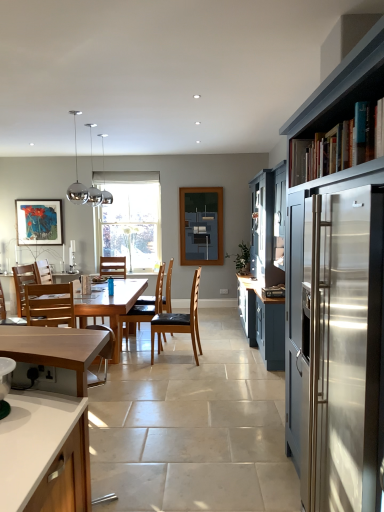
Question: Considering the positions of point (109, 258) and point (372, 285), is point (109, 258) closer or farther from the camera than point (372, 285)?

Choices:
 (A) closer
 (B) farther

Answer: (B)

Question: Looking at their shapes, would you say wooden chair at center, which is the 1th chair in back-to-front order, is wider or thinner than matte dark blue cabinet at right, arranged as the first cabinetry when viewed from the right?

Choices:
 (A) wide
 (B) thin

Answer: (B)

Question: Estimate the real-world distances between objects in this image. Which object is farther from the wooden chair at center, the 5th chair from the back?

Choices:
 (A) light brown wood countertop at lower left, the 2th cabinetry from the right
 (B) matte glass picture frame at upper left
 (C) wooden chair at center, the fifth chair viewed from the front
 (D) brown leather chair at center, which is the 4th chair from front to back
 (E) light brown wooden chair at center, which ranks as the fourth chair in back-to-front order

Answer: (C)

Question: Considering the real-world distances, which object is farthest from the light brown wooden chair at center, which ranks as the fourth chair in back-to-front order?

Choices:
 (A) clear glass window at center
 (B) wooden chair at center, which is the 1th chair in back-to-front order
 (C) matte glass picture frame at upper left
 (D) brown leather chair at center, arranged as the third chair when viewed from the front
 (E) brown leather chair at center

Answer: (A)